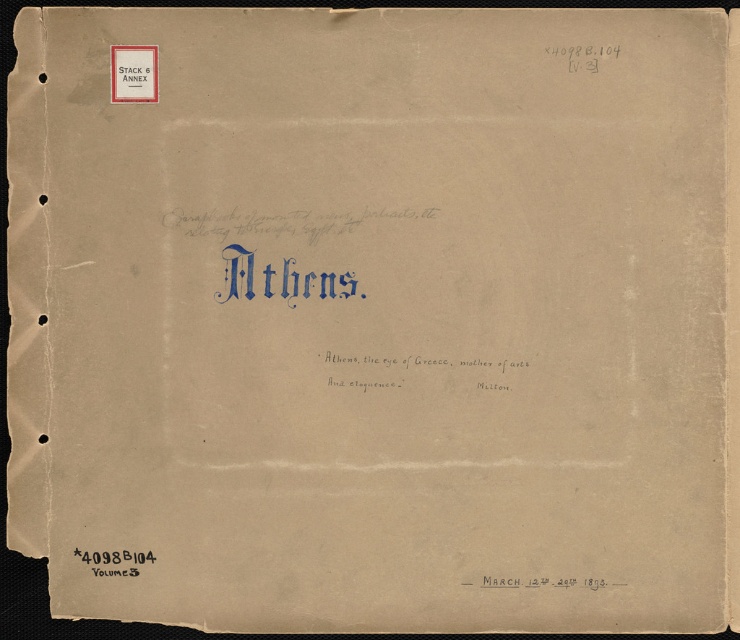
Who is higher up, black ink writing at center or matte white sign at upper left?

matte white sign at upper left is higher up.

Does black ink writing at center appear over matte white sign at upper left?

Actually, black ink writing at center is below matte white sign at upper left.

In order to click on black ink writing at center in this screenshot , I will do `click(413, 371)`.

Locate an element on the screen. This screenshot has width=740, height=640. black ink writing at center is located at coordinates (413, 371).